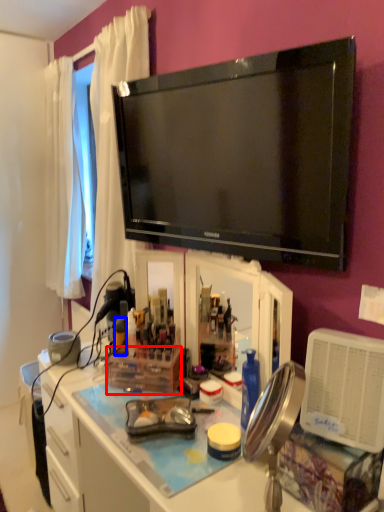
Question: Which object is further to the camera taking this photo, box (highlighted by a red box) or bottle (highlighted by a blue box)?

Choices:
 (A) box
 (B) bottle

Answer: (B)